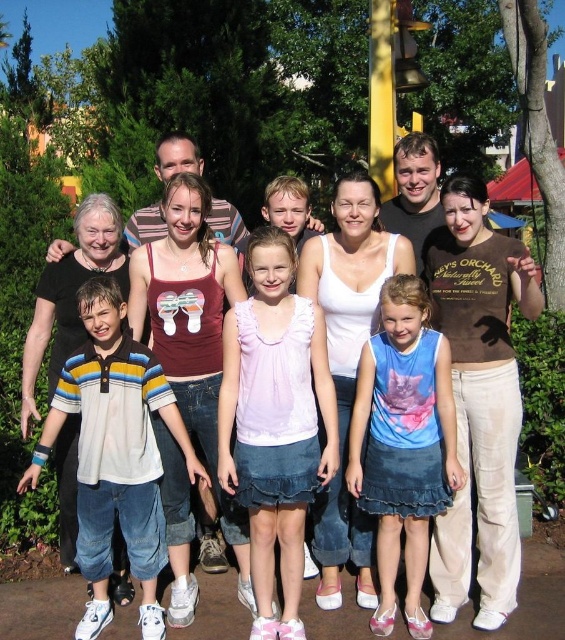
You are a photographer trying to capture a candid shot of the blue denim skirt at center without including the striped cotton shirt at left in the frame. Is this possible given their positions?

The blue denim skirt at center is behind the striped cotton shirt at left, so it would be blocked from view. You cannot capture the blue denim skirt at center without the striped cotton shirt at left in the frame.